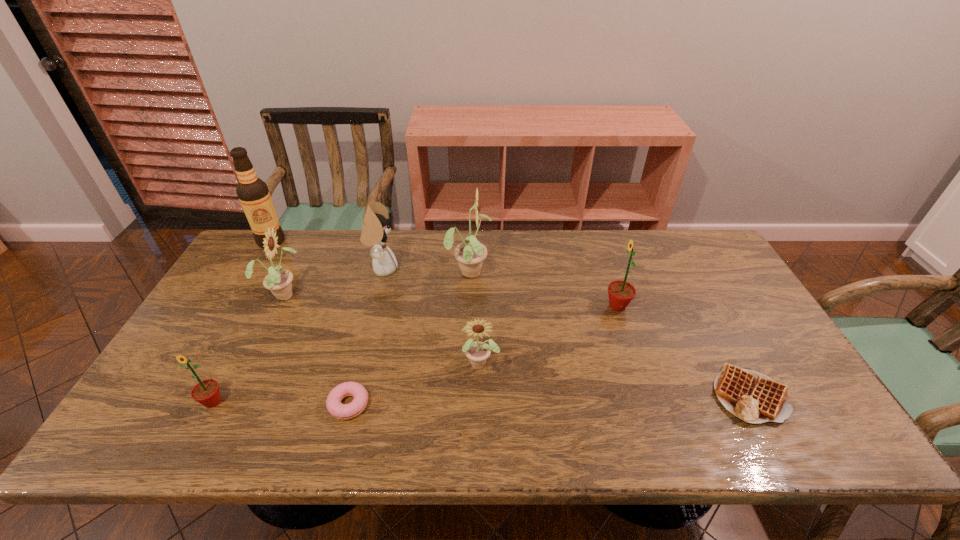
The image size is (960, 540). What are the coordinates of `free spot that satisfies the following two spatial constraints: 1. on the face of the pink doughnut; 2. on the right side of the left green sunflower` in the screenshot? It's located at (211, 404).

Image resolution: width=960 pixels, height=540 pixels. Find the location of `vacant space that satisfies the following two spatial constraints: 1. on the front-facing side of the pink doughnut; 2. on the left side of the second smallest yellow sunflower`. vacant space that satisfies the following two spatial constraints: 1. on the front-facing side of the pink doughnut; 2. on the left side of the second smallest yellow sunflower is located at coordinates tap(230, 404).

I want to click on free space in the image that satisfies the following two spatial constraints: 1. on the back side of the waffle; 2. on the front-facing side of the second biggest yellow sunflower, so click(x=695, y=294).

Locate an element on the screen. Image resolution: width=960 pixels, height=540 pixels. free space that satisfies the following two spatial constraints: 1. on the face of the farther green sunflower; 2. on the face of the nearer green sunflower is located at coordinates (649, 402).

Locate an element on the screen. This screenshot has width=960, height=540. vacant space that satisfies the following two spatial constraints: 1. on the front-facing side of the leftmost yellow sunflower; 2. on the face of the smaller green sunflower is located at coordinates (231, 402).

Where is `vacant space that satisfies the following two spatial constraints: 1. on the front-facing side of the nearest yellow sunflower; 2. on the left side of the waffle`? The width and height of the screenshot is (960, 540). vacant space that satisfies the following two spatial constraints: 1. on the front-facing side of the nearest yellow sunflower; 2. on the left side of the waffle is located at coordinates (481, 394).